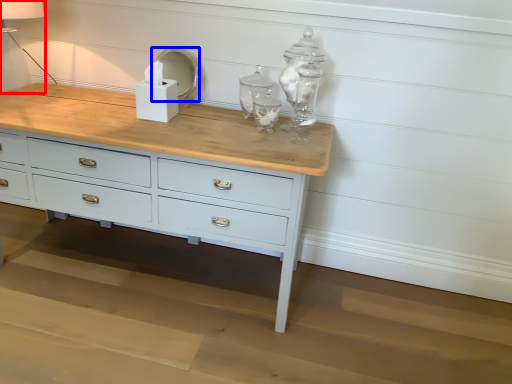
Question: Which object appears farthest to the camera in this image, table lamp (highlighted by a red box) or mirror (highlighted by a blue box)?

Choices:
 (A) table lamp
 (B) mirror

Answer: (B)